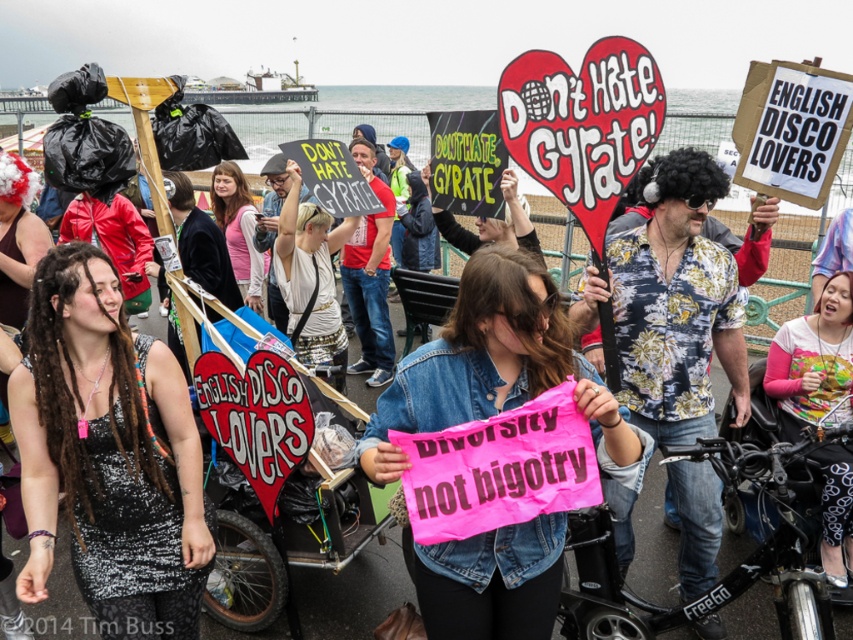
Question: Is pink fabric shirt at lower right to the left of pink fabric shirt at center from the viewer's perspective?

Choices:
 (A) no
 (B) yes

Answer: (A)

Question: Which point is closer to the camera?

Choices:
 (A) pink fabric sign at center
 (B) pink fabric shirt at center

Answer: (A)

Question: Does pink fabric sign at center appear under pink fabric shirt at center?

Choices:
 (A) no
 (B) yes

Answer: (B)

Question: Is black sequined dress at center smaller than pink fabric shirt at center?

Choices:
 (A) yes
 (B) no

Answer: (B)

Question: Which point is closer to the camera?

Choices:
 (A) pink fabric shirt at center
 (B) pink fabric sign at center
 (C) black sequined dress at center
 (D) pink fabric shirt at lower right

Answer: (B)

Question: Which of the following is the closest to the observer?

Choices:
 (A) (103, 509)
 (B) (851, 477)
 (C) (386, 401)

Answer: (C)